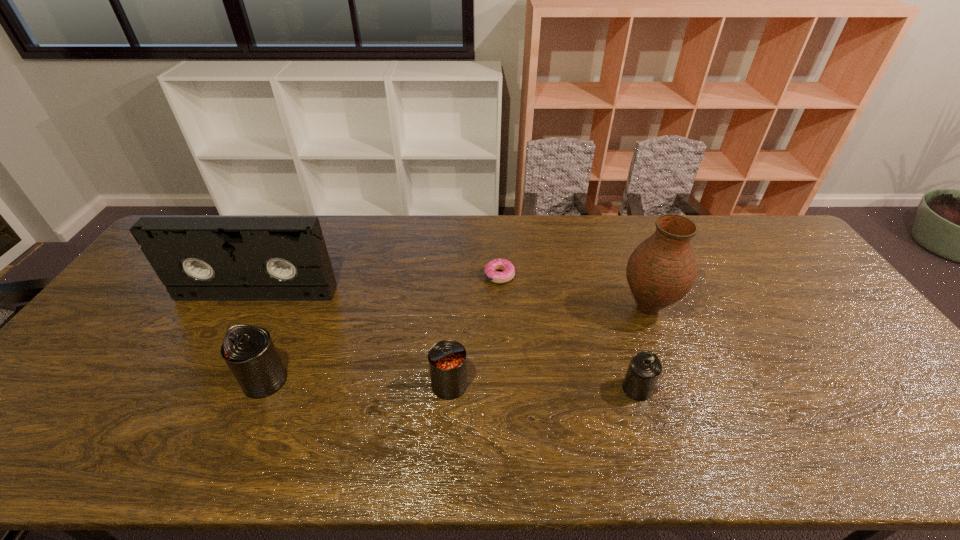
Please point a free position for a can on the right. Please provide its 2D coordinates. Your answer should be formatted as a tuple, i.e. [(x, y)], where the tuple contains the x and y coordinates of a point satisfying the conditions above.

[(828, 393)]